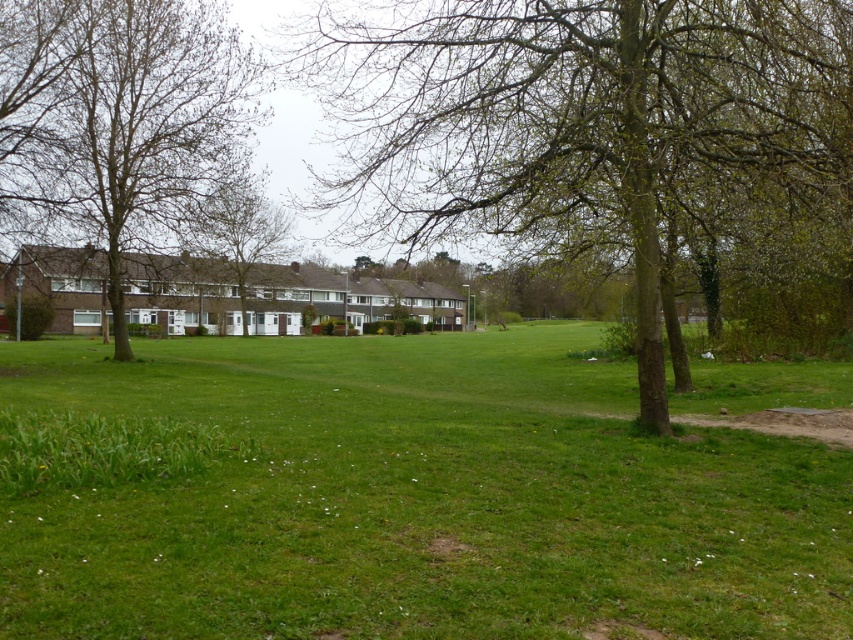
Is point (70, 401) farther from camera compared to point (674, 76)?

That is True.

Does green grassy field at center appear on the right side of brown rough tree at center?

In fact, green grassy field at center is to the left of brown rough tree at center.

Between point (463, 500) and point (525, 12), which one is positioned in front?

Point (463, 500) is in front.

The width and height of the screenshot is (853, 640). I want to click on green grassy field at center, so click(x=416, y=499).

I want to click on green grassy field at center, so click(416, 499).

The image size is (853, 640). What do you see at coordinates (416, 499) in the screenshot? I see `green grassy field at center` at bounding box center [416, 499].

Is point (827, 518) positioned behind point (161, 160)?

No, (827, 518) is closer to viewer.

At what (x,y) coordinates should I click in order to perform the action: click on green grassy field at center. Please return your answer as a coordinate pair (x, y). Looking at the image, I should click on (416, 499).

Between brown rough tree at center and brown leafless tree at left, which one appears on the left side from the viewer's perspective?

Positioned to the left is brown leafless tree at left.

Is brown rough tree at center to the left of brown leafless tree at left from the viewer's perspective?

No, brown rough tree at center is not to the left of brown leafless tree at left.

Does point (601, 13) lie in front of point (102, 225)?

Yes, point (601, 13) is closer to viewer.

The width and height of the screenshot is (853, 640). What are the coordinates of `brown rough tree at center` in the screenshot? It's located at (567, 116).